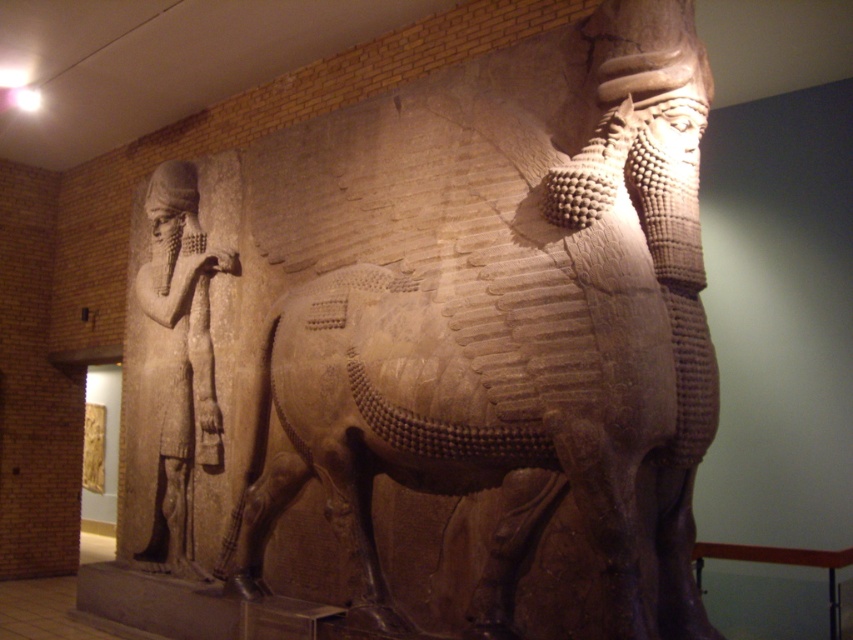
Can you confirm if brown stone horse at center is positioned above brown stone figure at left?

Indeed, brown stone horse at center is positioned over brown stone figure at left.

You are a GUI agent. You are given a task and a screenshot of the screen. Output one action in this format:
    pyautogui.click(x=<x>, y=<y>)
    Task: Click on the brown stone horse at center
    The height and width of the screenshot is (640, 853).
    Given the screenshot: What is the action you would take?
    pyautogui.click(x=502, y=323)